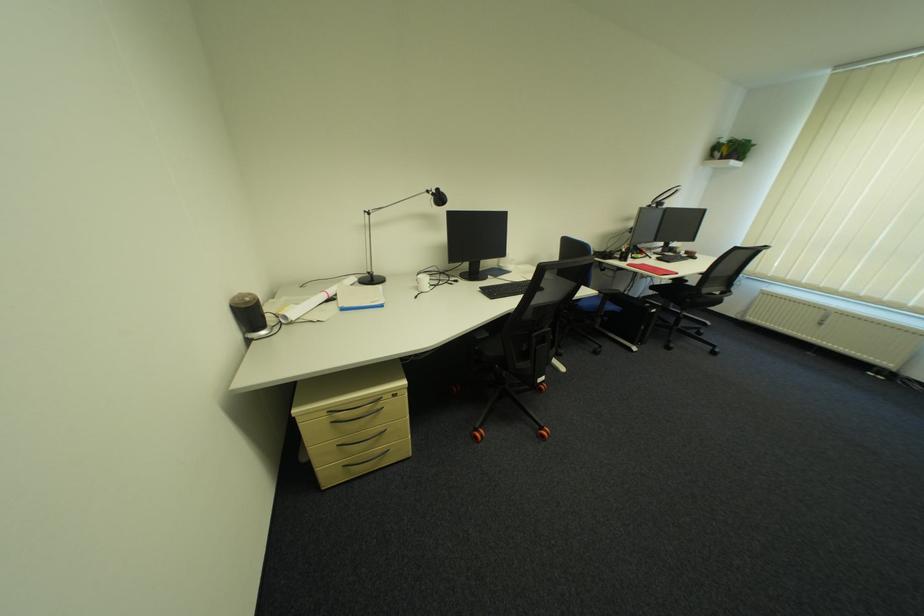
This screenshot has width=924, height=616. Describe the element at coordinates (356, 406) in the screenshot. I see `the cabinet drawer handle` at that location.